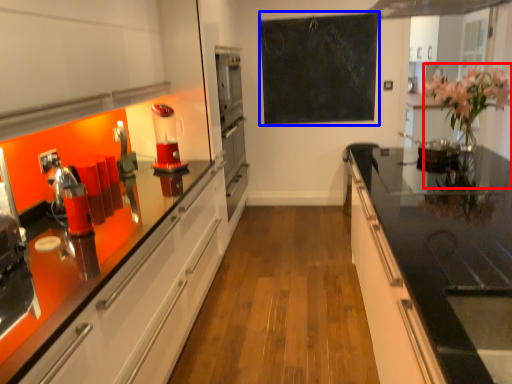
Question: Which point is closer to the camera, floral arrangement (highlighted by a red box) or bulletin board (highlighted by a blue box)?

Choices:
 (A) floral arrangement
 (B) bulletin board

Answer: (A)